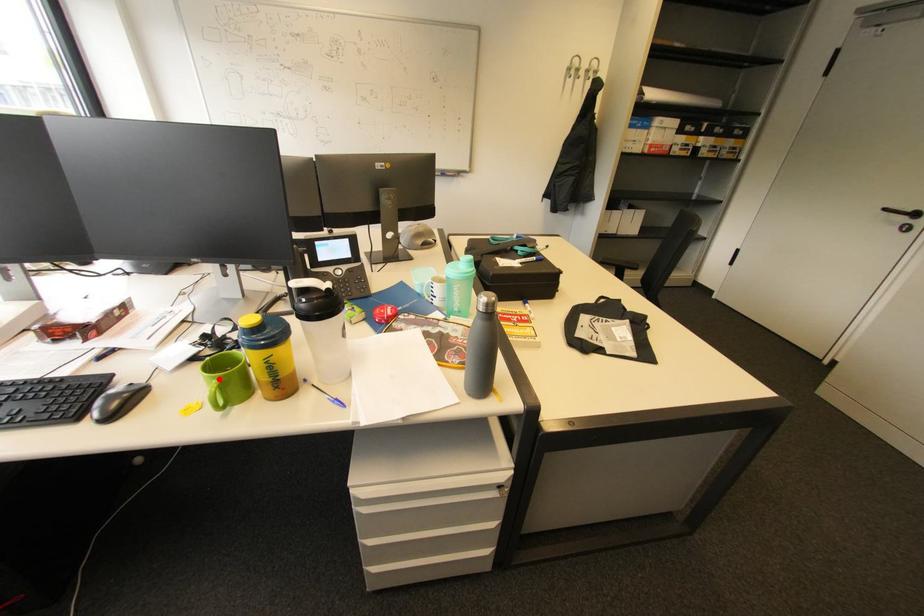
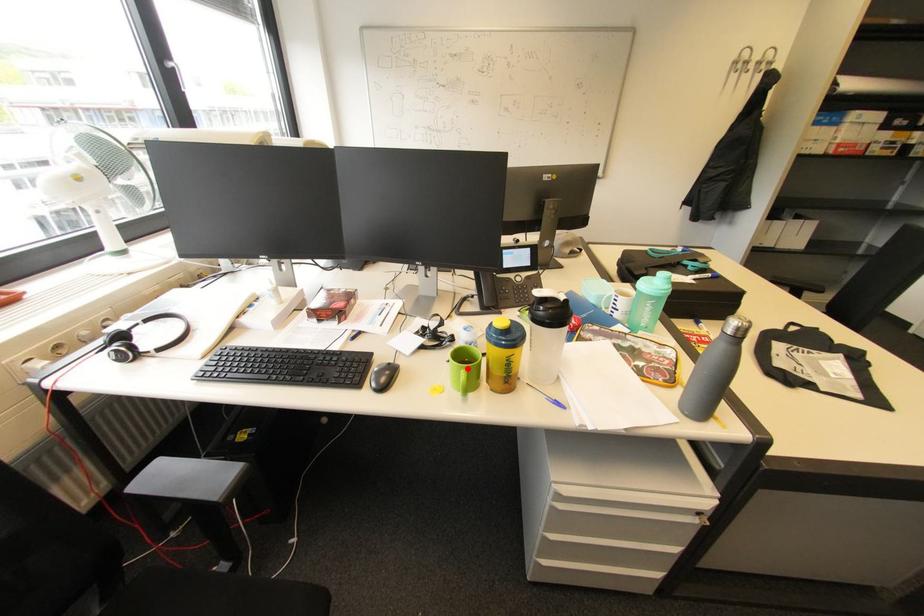
I am providing you with two images of the same scene from different viewpoints. A red point is marked on the first image and another point is marked on the second image. Does the point marked in image1 correspond to the same location as the one in image2?

Yes